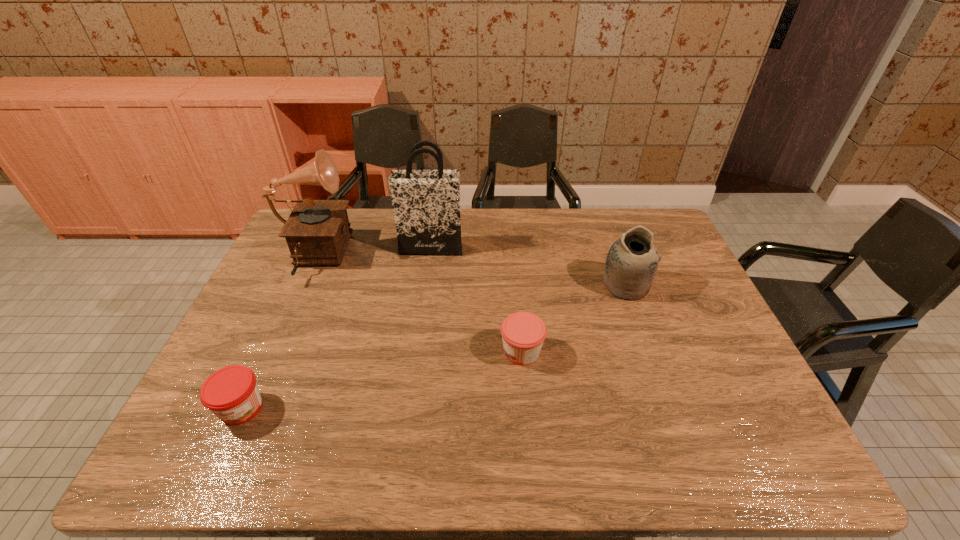
You are a GUI agent. You are given a task and a screenshot of the screen. Output one action in this format:
    pyautogui.click(x=<x>, y=<y>)
    Task: Click on the free region that satisfies the following two spatial constraints: 1. on the front of the third object from left to right with the design; 2. on the right side of the rightmost object
    
    Given the screenshot: What is the action you would take?
    pyautogui.click(x=425, y=285)

At what (x,y) coordinates should I click in order to perform the action: click on free region that satisfies the following two spatial constraints: 1. on the front of the third object from right to left with the design; 2. on the horn of the record player. Please return your answer as a coordinate pair (x, y). This screenshot has height=540, width=960. Looking at the image, I should click on (429, 258).

Find the location of `vacant space that satisfies the following two spatial constraints: 1. on the front of the shopping bag with the design; 2. on the horn of the record player`. vacant space that satisfies the following two spatial constraints: 1. on the front of the shopping bag with the design; 2. on the horn of the record player is located at coordinates (429, 258).

Locate an element on the screen. This screenshot has width=960, height=540. vacant space that satisfies the following two spatial constraints: 1. on the front of the third tallest object with the design; 2. on the right side of the shopping bag is located at coordinates coord(425,285).

I want to click on vacant space that satisfies the following two spatial constraints: 1. on the back side of the rightmost object; 2. on the horn of the record player, so click(616, 258).

Find the location of a particular element. Image resolution: width=960 pixels, height=540 pixels. vacant space that satisfies the following two spatial constraints: 1. on the horn of the third tallest object; 2. on the left side of the record player is located at coordinates (300, 285).